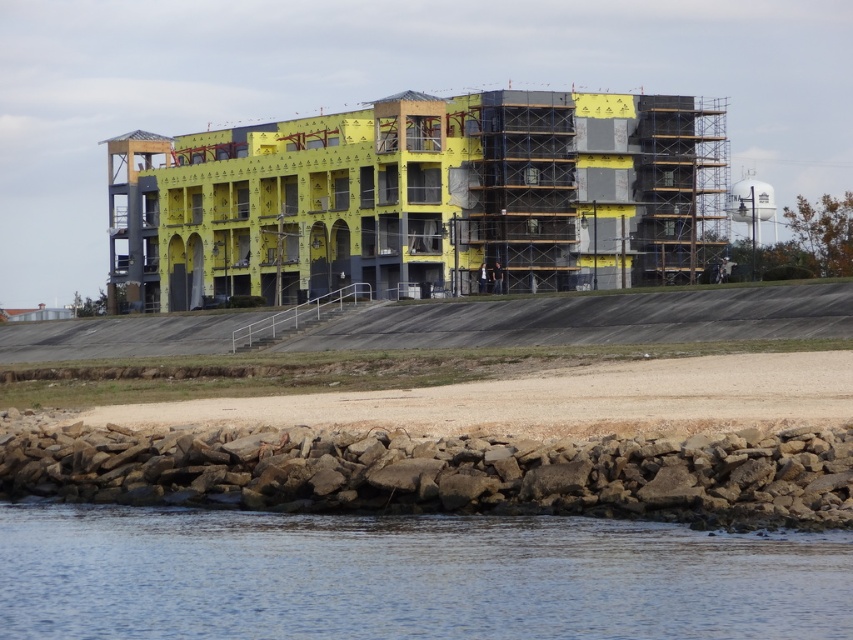
You are a safety inspector at the construction site. You need to ensure that the yellow foam insulation at center is at least 100 meters away from the clear water at lower center to comply with environmental regulations. Based on the scene, is the current distance compliant?

The distance between the yellow foam insulation at center and the clear water at lower center is 94.96 meters, which is less than the required 100 meters. Therefore, the current distance does not comply with the environmental regulations.

You are a construction worker who needs to place a new piece of equipment on the site. The equipment requires a flat, stable surface. Based on the image, which area would be more suitable for placing the equipment between the yellow foam insulation at center and the clear water at lower center?

The yellow foam insulation at center is larger in size than the clear water at lower center, so the yellow foam insulation at center would provide a more stable and suitable surface for placing the equipment.